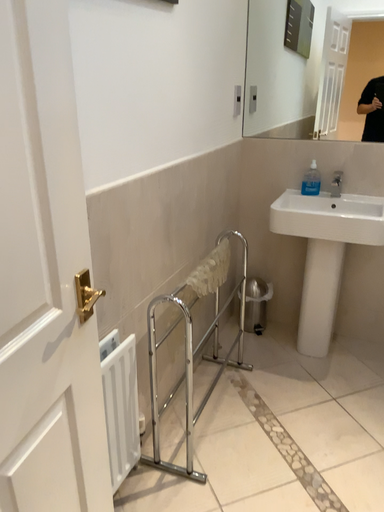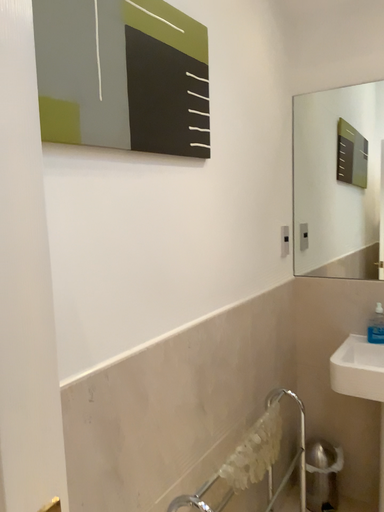
Question: How did the camera likely rotate when shooting the video?

Choices:
 (A) rotated right
 (B) rotated left

Answer: (B)